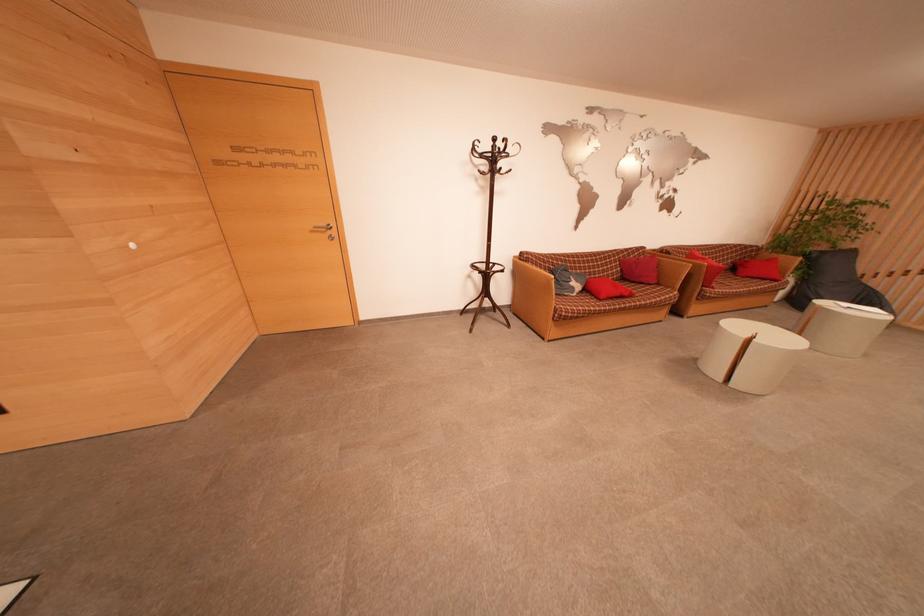
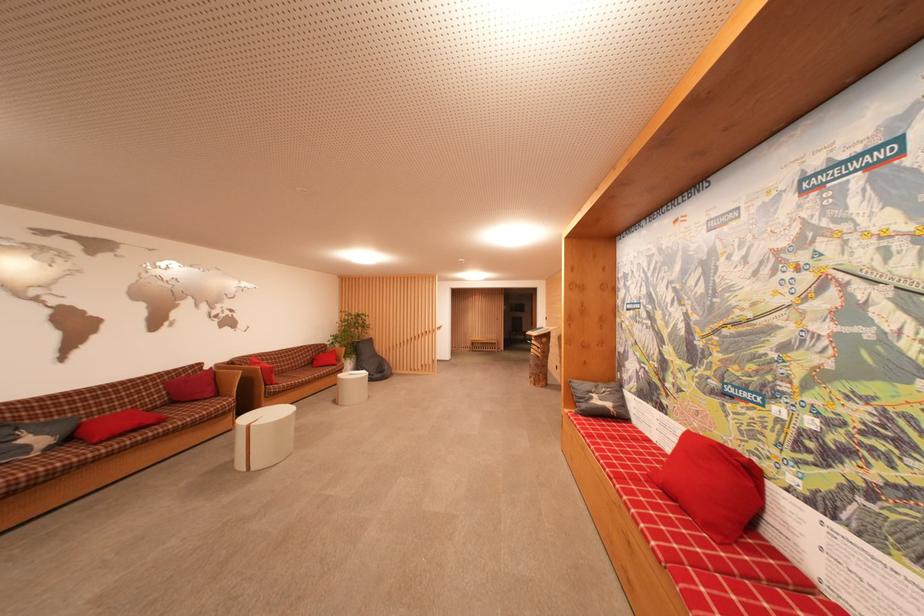
In the second image, find the point that corresponds to the point at 633,257 in the first image.

(183, 378)